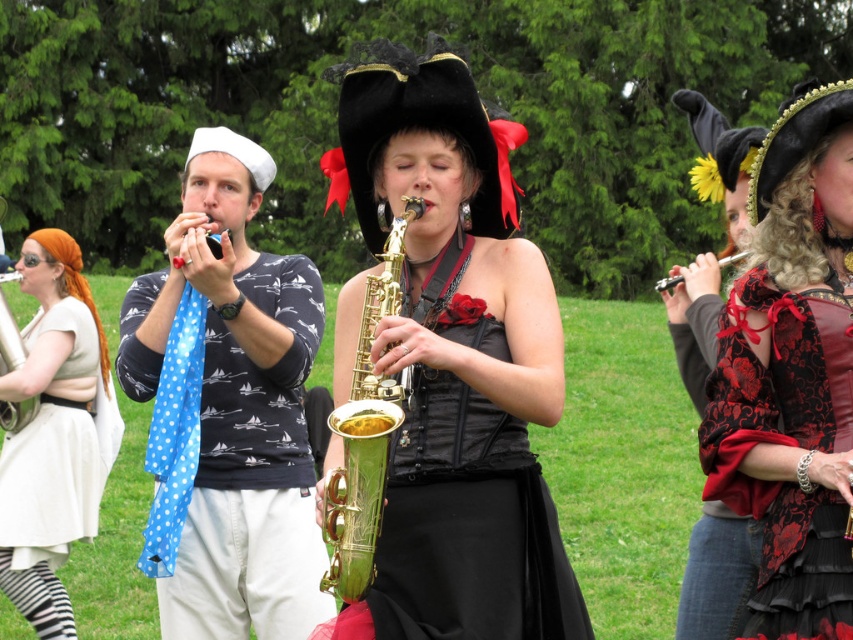
Is point (274, 540) positioned behind point (693, 632)?

That is True.

Who is positioned more to the left, blue dotted scarf at left or velvet red vest at center?

Positioned to the left is blue dotted scarf at left.

You are a GUI agent. You are given a task and a screenshot of the screen. Output one action in this format:
    pyautogui.click(x=<x>, y=<y>)
    Task: Click on the blue dotted scarf at left
    The height and width of the screenshot is (640, 853).
    Given the screenshot: What is the action you would take?
    pyautogui.click(x=235, y=404)

I want to click on blue dotted scarf at left, so click(235, 404).

Who is lower down, velvet red corset at center or silver metallic flute at upper right?

velvet red corset at center

In the scene shown: Does velvet red corset at center appear on the left side of silver metallic flute at upper right?

Correct, you'll find velvet red corset at center to the left of silver metallic flute at upper right.

The height and width of the screenshot is (640, 853). I want to click on velvet red corset at center, so click(x=792, y=372).

Find the location of a particular element. The height and width of the screenshot is (640, 853). velvet red corset at center is located at coordinates (792, 372).

Can you confirm if shiny gold saxophone at center is positioned above blue dotted scarf at left?

Yes, shiny gold saxophone at center is above blue dotted scarf at left.

Can you confirm if shiny gold saxophone at center is positioned to the right of blue dotted scarf at left?

Correct, you'll find shiny gold saxophone at center to the right of blue dotted scarf at left.

Does point (509, 404) lie in front of point (206, 493)?

Yes.

The height and width of the screenshot is (640, 853). Find the location of `shiny gold saxophone at center`. shiny gold saxophone at center is located at coordinates (456, 356).